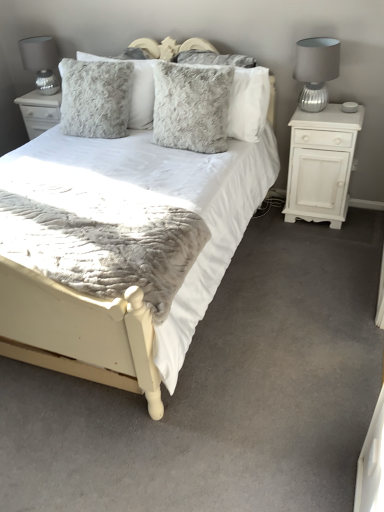
You are a GUI agent. You are given a task and a screenshot of the screen. Output one action in this format:
    pyautogui.click(x=<x>, y=<y>)
    Task: Click on the free area below silver ribbed glass table lamp at right, the 1th table lamp positioned from the front (from a real-world perspective)
    
    Given the screenshot: What is the action you would take?
    pyautogui.click(x=312, y=112)